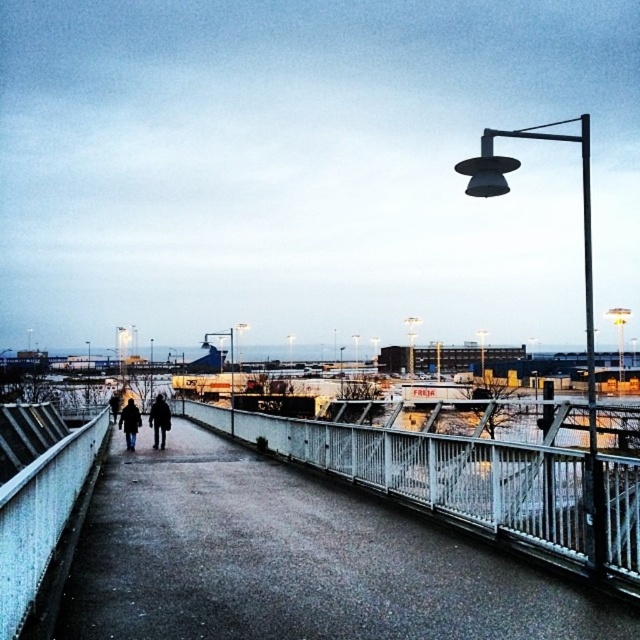
You are standing at the point marked by the coordinates [160,420] in the image. Looking around, you see a dark gray jacket at center. Which direction should you walk to reach the nearest streetlamp?

The point is on the dark gray jacket at center. To reach the nearest streetlamp, you should walk towards the right side of the frame where the streetlamp is located.

Looking at this image, you are a photographer trying to capture both the dark gray wool coat at center and the dark blue coat at center in a single shot. Since both are at the center, which coat will appear closer to the camera in the photo?

The dark gray wool coat at center will appear closer to the camera because the dark blue coat at center is positioned behind it.

You are a fashion designer observing the image and want to create a layered look using the dark gray wool coat at center and the dark gray jacket at center. Which piece should you place over the other to match the arrangement in the image?

The dark gray wool coat at center should be placed below the dark gray jacket at center to match the arrangement in the image.